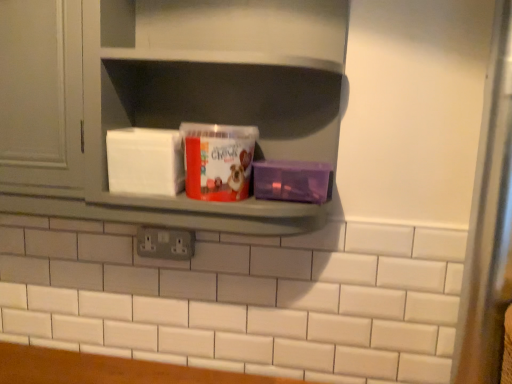
Question: Is matte gray shelf at center positioned before matte plastic tub at center?

Choices:
 (A) no
 (B) yes

Answer: (B)

Question: Is matte gray shelf at center at the left side of matte plastic tub at center?

Choices:
 (A) yes
 (B) no

Answer: (B)

Question: From the image's perspective, does matte gray shelf at center appear higher than matte plastic tub at center?

Choices:
 (A) yes
 (B) no

Answer: (A)

Question: From a real-world perspective, is matte gray shelf at center physically below matte plastic tub at center?

Choices:
 (A) yes
 (B) no

Answer: (B)

Question: Considering the relative sizes of matte gray shelf at center and matte plastic tub at center in the image provided, is matte gray shelf at center bigger than matte plastic tub at center?

Choices:
 (A) no
 (B) yes

Answer: (B)

Question: Is matte gray shelf at center turned away from matte plastic tub at center?

Choices:
 (A) no
 (B) yes

Answer: (B)

Question: Is matte gray shelf at center wider than transparent glass door at right?

Choices:
 (A) no
 (B) yes

Answer: (B)

Question: Considering the relative sizes of matte gray shelf at center and transparent glass door at right in the image provided, is matte gray shelf at center shorter than transparent glass door at right?

Choices:
 (A) yes
 (B) no

Answer: (A)

Question: Is matte gray shelf at center positioned with its back to transparent glass door at right?

Choices:
 (A) no
 (B) yes

Answer: (A)

Question: Does matte gray shelf at center come in front of transparent glass door at right?

Choices:
 (A) yes
 (B) no

Answer: (A)

Question: Is matte gray shelf at center far away from transparent glass door at right?

Choices:
 (A) yes
 (B) no

Answer: (B)

Question: Can transparent glass door at right be found inside matte gray shelf at center?

Choices:
 (A) yes
 (B) no

Answer: (B)

Question: Is matte gray cabinet at upper left at the back of gray plastic electric outlet at center?

Choices:
 (A) yes
 (B) no

Answer: (B)